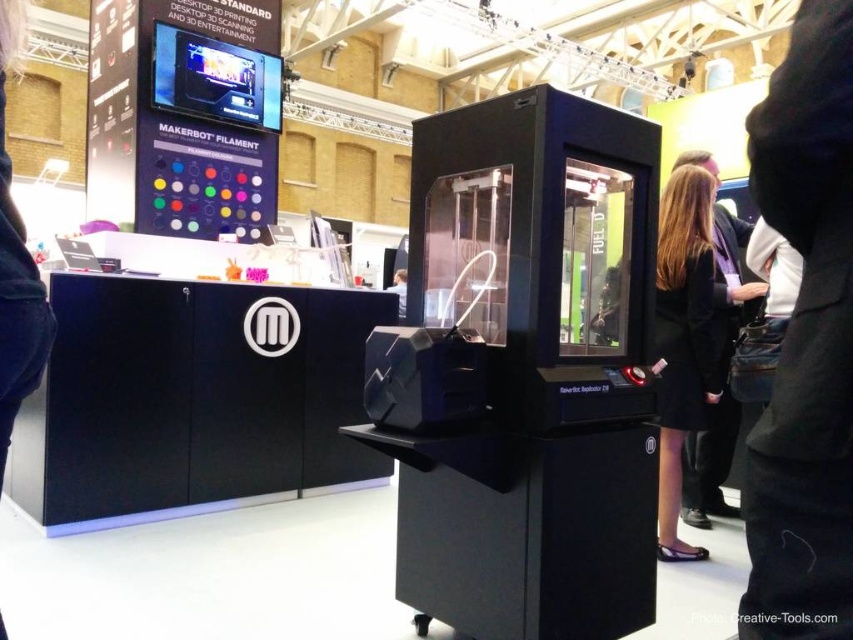
You are standing at the trade show booth and see the 3D printer and the point marked at coordinates [805,342]. Where is this point located in relation to the black fabric pants at lower right?

The point at coordinates [805,342] is located on the black fabric pants at lower right.

You are standing at the 3D printing station and want to reach the point at coordinates (837, 282). If your arm can extend 36 inches, can you reach it?

The point at coordinates (837, 282) is 37.20 inches away from you, so your arm cannot reach it since it can only extend 36 inches.

Looking at this image, you are an attendee at the trade show and you see the black fabric pants at lower right and the black fabric coat at right. Which item is positioned higher in the image?

The black fabric pants at lower right is above the black fabric coat at right, so the pants are positioned higher.